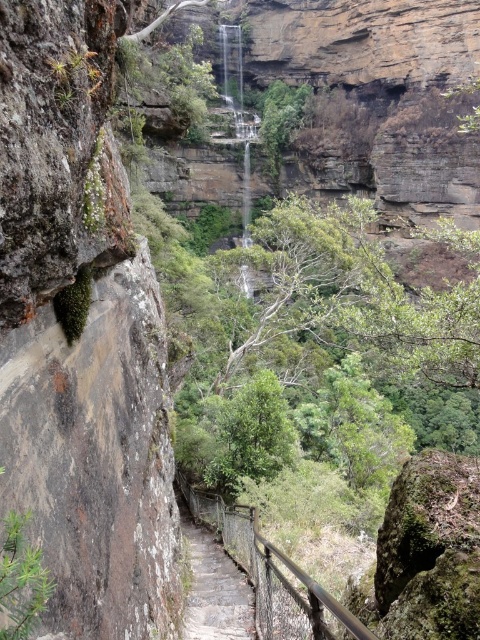
You are standing at the base of the waterfall and want to ascend the stone staircase. The metal railing is at point (273, 576). Which direction should you head to reach the metal railing at center?

The metal railing at center is located at point (273, 576), so you should head towards that coordinate to reach it.